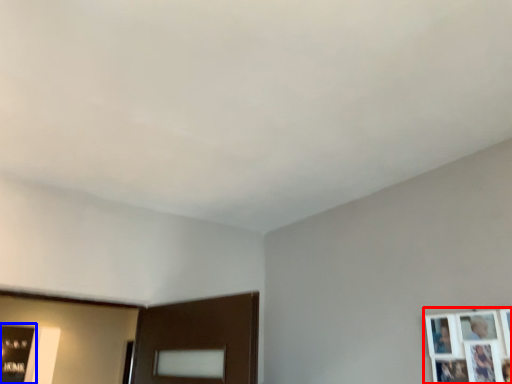
Question: Among these objects, which one is farthest to the camera, picture frame (highlighted by a red box) or picture frame (highlighted by a blue box)?

Choices:
 (A) picture frame
 (B) picture frame

Answer: (B)